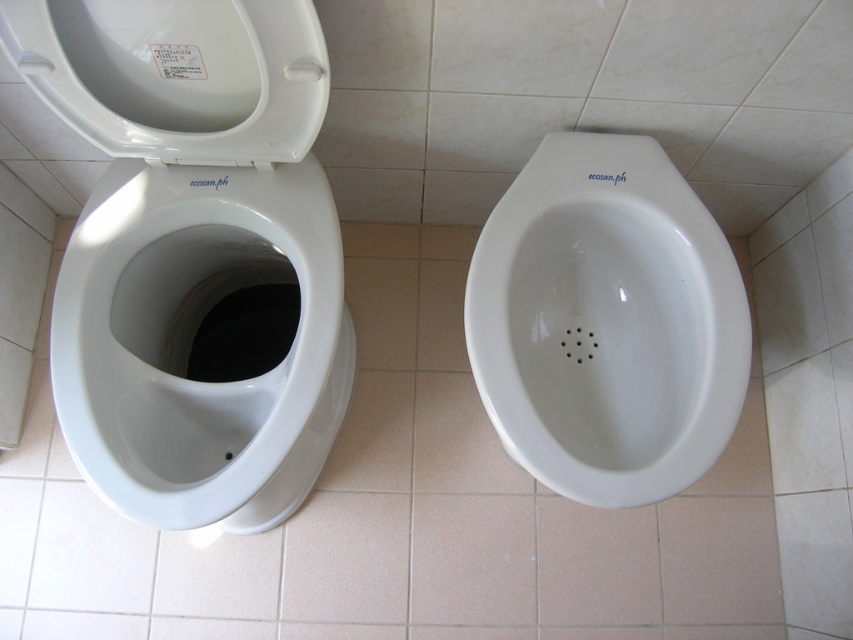
You are a plumber inspecting a bathroom with a white glossy toilet bowl at left and a white glossy urinal at center. You need to install a new water supply line. Which object requires a connection point that is higher due to its size?

The white glossy toilet bowl at left requires a connection point that is higher because it has a larger size compared to the white glossy urinal at center.

In the scene shown: You are a maintenance worker inspecting the toilets. You need to determine which part is taller between the white glossy toilet bowl at left and the white glossy toilet lid at upper left. Which one is taller?

The white glossy toilet bowl at left is taller than the white glossy toilet lid at upper left.